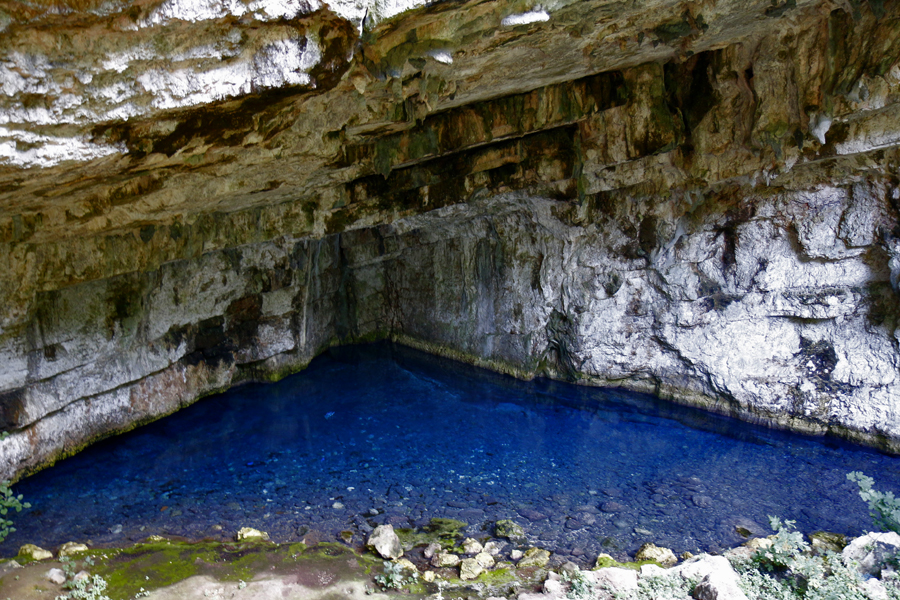
You are a GUI agent. You are given a task and a screenshot of the screen. Output one action in this format:
    pyautogui.click(x=<x>, y=<y>)
    Task: Click on the corner
    The width and height of the screenshot is (900, 600).
    Given the screenshot: What is the action you would take?
    pyautogui.click(x=374, y=317)